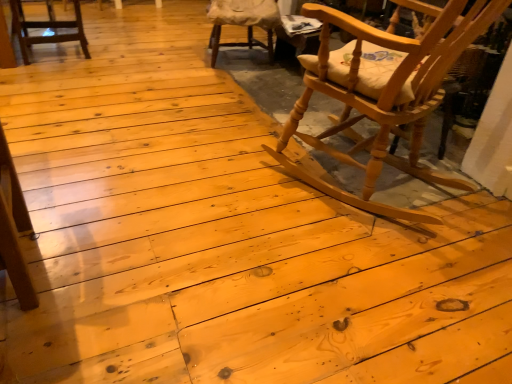
Find the location of a particular element. The height and width of the screenshot is (384, 512). vacant point to the left of natural wood rocking chair at right, which is the 3th chair from back to front is located at coordinates point(214,173).